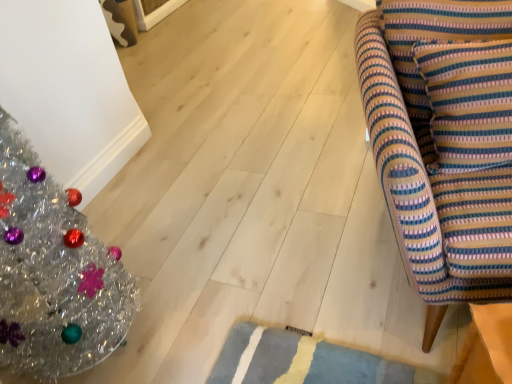
Question: From a real-world perspective, is striped fabric cushion at right on top of striped fabric armchair at right?

Choices:
 (A) yes
 (B) no

Answer: (A)

Question: Is striped fabric cushion at right positioned before striped fabric armchair at right?

Choices:
 (A) no
 (B) yes

Answer: (A)

Question: Is striped fabric cushion at right next to striped fabric armchair at right?

Choices:
 (A) no
 (B) yes

Answer: (A)

Question: Can you confirm if striped fabric cushion at right is positioned to the left of striped fabric armchair at right?

Choices:
 (A) yes
 (B) no

Answer: (A)

Question: Considering the relative positions of striped fabric cushion at right and striped fabric armchair at right in the image provided, is striped fabric cushion at right to the right of striped fabric armchair at right from the viewer's perspective?

Choices:
 (A) yes
 (B) no

Answer: (B)

Question: Is striped fabric cushion at right completely or partially outside of striped fabric armchair at right?

Choices:
 (A) no
 (B) yes

Answer: (A)

Question: Can you confirm if striped fabric cushion at right is smaller than shiny silver christmas tree at left?

Choices:
 (A) yes
 (B) no

Answer: (A)

Question: Is shiny silver christmas tree at left at the back of striped fabric cushion at right?

Choices:
 (A) no
 (B) yes

Answer: (A)

Question: From a real-world perspective, is striped fabric cushion at right positioned over shiny silver christmas tree at left based on gravity?

Choices:
 (A) yes
 (B) no

Answer: (A)

Question: Considering the relative positions of striped fabric cushion at right and shiny silver christmas tree at left in the image provided, is striped fabric cushion at right to the left of shiny silver christmas tree at left from the viewer's perspective?

Choices:
 (A) no
 (B) yes

Answer: (A)

Question: From the image's perspective, is striped fabric cushion at right on top of shiny silver christmas tree at left?

Choices:
 (A) no
 (B) yes

Answer: (B)

Question: Is striped fabric cushion at right beside shiny silver christmas tree at left?

Choices:
 (A) no
 (B) yes

Answer: (A)

Question: Is the depth of striped fabric armchair at right greater than that of striped fabric cushion at right?

Choices:
 (A) yes
 (B) no

Answer: (B)